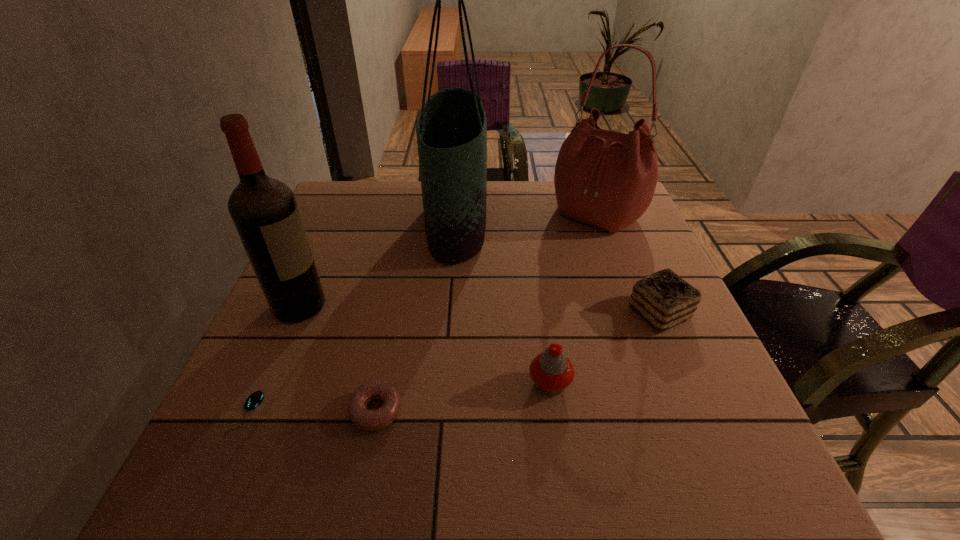
This screenshot has height=540, width=960. I want to click on vacant point located between the doughnut and the mouse, so click(x=311, y=412).

The width and height of the screenshot is (960, 540). Find the location of `vacant space that is in between the second shortest object and the tallest object`. vacant space that is in between the second shortest object and the tallest object is located at coordinates (417, 317).

You are a GUI agent. You are given a task and a screenshot of the screen. Output one action in this format:
    pyautogui.click(x=<x>, y=<y>)
    Task: Click on the empty location between the cupcake and the liquor
    This screenshot has width=960, height=540.
    Given the screenshot: What is the action you would take?
    pyautogui.click(x=424, y=345)

Where is `free spot between the second shortest object and the fifth tallest object`? Image resolution: width=960 pixels, height=540 pixels. free spot between the second shortest object and the fifth tallest object is located at coordinates (517, 362).

At what (x,y) coordinates should I click in order to perform the action: click on unoccupied area between the liquor and the chocolate cake. Please return your answer as a coordinate pair (x, y). Image resolution: width=960 pixels, height=540 pixels. Looking at the image, I should click on (479, 309).

I want to click on free area in between the liquor and the third shortest object, so click(x=479, y=309).

In order to click on object that is the second nearest to the handbag in this screenshot , I will do `click(664, 299)`.

Where is `object that is the closest one to the cupcake`? The image size is (960, 540). object that is the closest one to the cupcake is located at coordinates (664, 299).

This screenshot has width=960, height=540. What are the coordinates of `free space that satisfies the following two spatial constraints: 1. on the front-facing side of the chocolate cake; 2. on the left side of the liquor` in the screenshot? It's located at (297, 313).

This screenshot has width=960, height=540. I want to click on free spot that satisfies the following two spatial constraints: 1. on the front-facing side of the liquor; 2. on the back side of the fifth tallest object, so click(x=297, y=313).